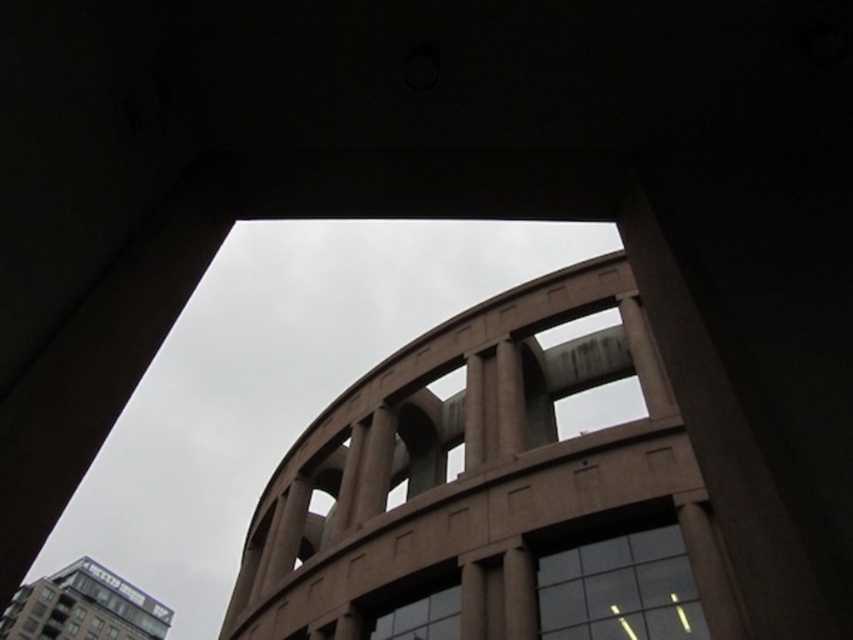
Does point (637, 554) come in front of point (1, 624)?

Yes, it is.

Does transparent glass window at center appear on the right side of glassy reflective building at lower left?

Correct, you'll find transparent glass window at center to the right of glassy reflective building at lower left.

This screenshot has height=640, width=853. Find the location of `transparent glass window at center`. transparent glass window at center is located at coordinates (619, 589).

Can you confirm if transparent glass window at center is thinner than clear glass window at center?

In fact, transparent glass window at center might be wider than clear glass window at center.

Does transparent glass window at center come behind clear glass window at center?

No, transparent glass window at center is closer to the viewer.

What do you see at coordinates (619, 589) in the screenshot? The image size is (853, 640). I see `transparent glass window at center` at bounding box center [619, 589].

This screenshot has width=853, height=640. Find the location of `transparent glass window at center`. transparent glass window at center is located at coordinates (619, 589).

Between glassy reflective building at lower left and clear glass window at center, which one has less height?

clear glass window at center

How far apart are glassy reflective building at lower left and clear glass window at center?

glassy reflective building at lower left is 236.94 feet away from clear glass window at center.

This screenshot has width=853, height=640. What are the coordinates of `glassy reflective building at lower left` in the screenshot? It's located at (83, 608).

What are the coordinates of `glassy reflective building at lower left` in the screenshot? It's located at (83, 608).